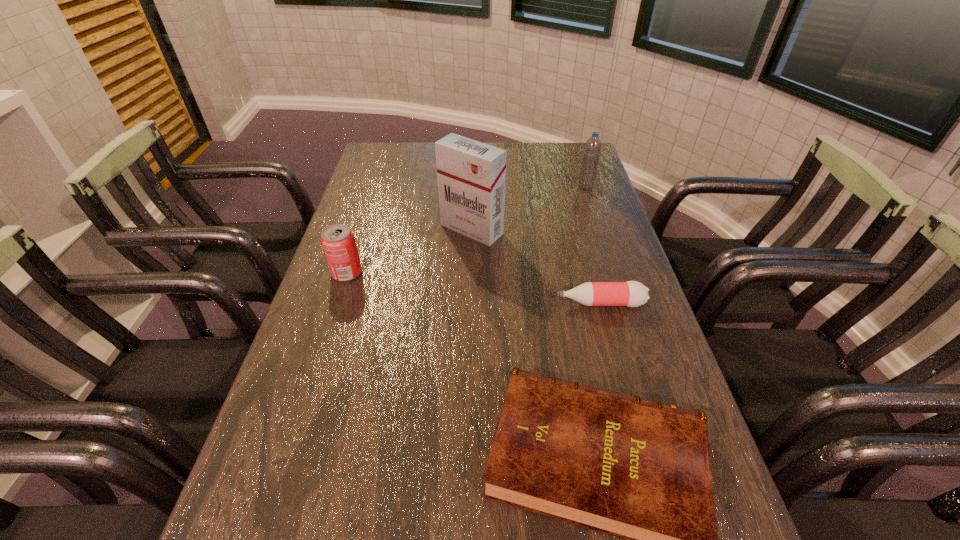
At what (x,y) coordinates should I click in order to perform the action: click on vacant point located between the fourth nearest object and the second tallest object. Please return your answer as a coordinate pair (x, y). This screenshot has height=540, width=960. Looking at the image, I should click on (529, 208).

This screenshot has height=540, width=960. In order to click on vacant area between the second farthest object and the third farthest object in this screenshot , I will do `click(409, 251)`.

Identify which object is located as the nearest to the leftmost object. Please provide its 2D coordinates. Your answer should be formatted as a tuple, i.e. [(x, y)], where the tuple contains the x and y coordinates of a point satisfying the conditions above.

[(471, 175)]

Choose which object is the third nearest neighbor to the farthest object. Please provide its 2D coordinates. Your answer should be formatted as a tuple, i.e. [(x, y)], where the tuple contains the x and y coordinates of a point satisfying the conditions above.

[(338, 242)]